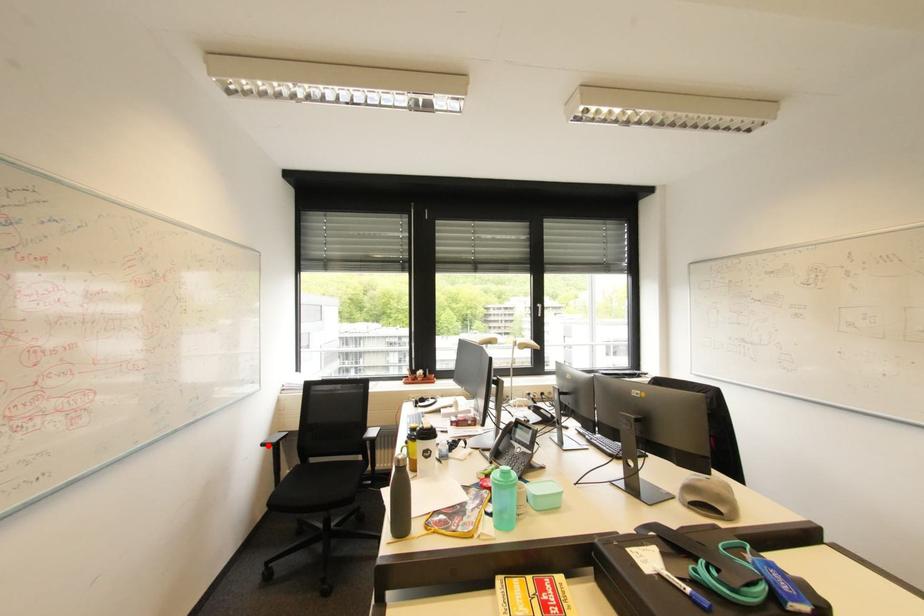
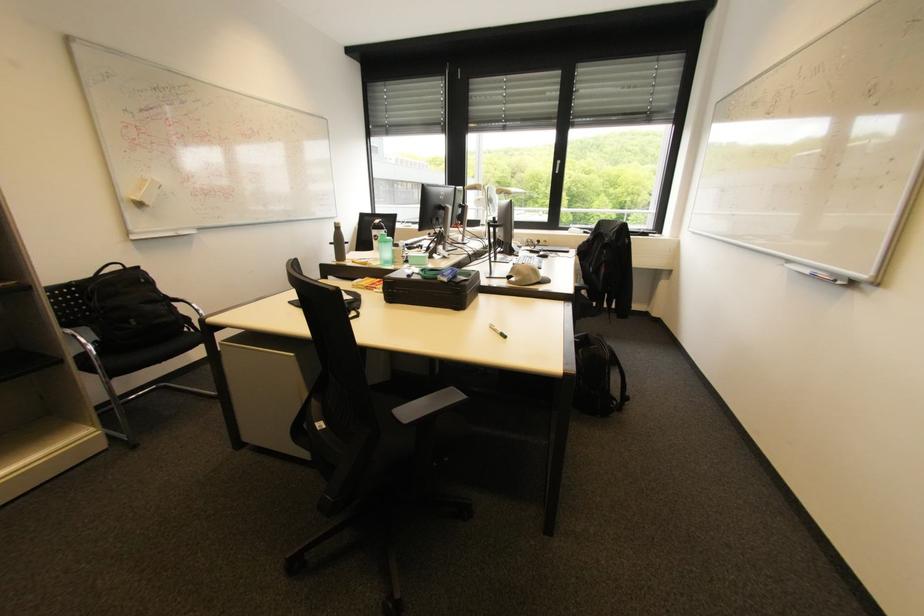
In the second image, find the point that corresponds to the highlighted location in the first image.

(335, 244)